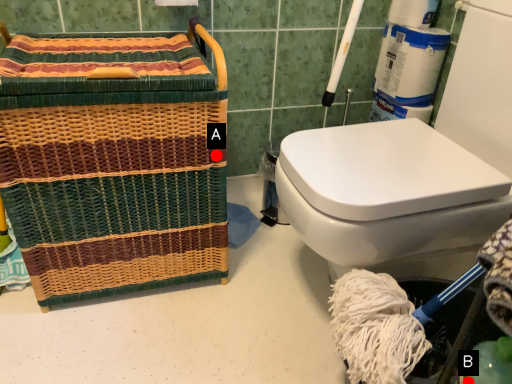
Question: Two points are circled on the image, labeled by A and B beside each circle. Which point is closer to the camera?

Choices:
 (A) A is closer
 (B) B is closer

Answer: (B)